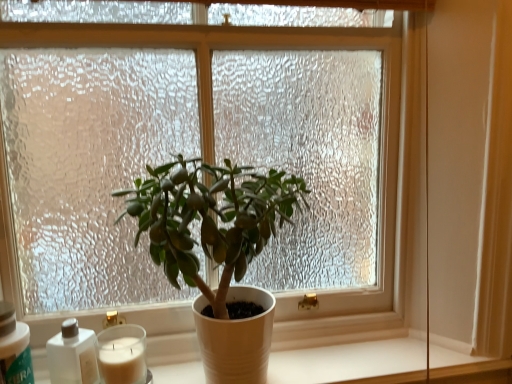
Question: From the image's perspective, is white plastic bottle at lower left, which appears as the 2th bottle when viewed from the right, located above or below white matte bottle at lower left, which appears as the 2th bottle when viewed from the left?

Choices:
 (A) below
 (B) above

Answer: (B)

Question: From a real-world perspective, is white plastic bottle at lower left, which appears as the 2th bottle when viewed from the right, above or below white matte bottle at lower left, positioned as the first bottle in right-to-left order?

Choices:
 (A) above
 (B) below

Answer: (A)

Question: Based on their relative distances, which object is nearer to the white matte bottle at lower left, which appears as the 2th bottle when viewed from the left?

Choices:
 (A) white matte pot at center
 (B) white plastic bottle at lower left, which appears as the 2th bottle when viewed from the right
 (C) white wax candle at lower left
 (D) matte white pot at center

Answer: (C)

Question: Based on their relative distances, which object is nearer to the white wax candle at lower left?

Choices:
 (A) white matte bottle at lower left, positioned as the first bottle in right-to-left order
 (B) matte white pot at center
 (C) white plastic bottle at lower left, which ranks as the first bottle in left-to-right order
 (D) white matte pot at center

Answer: (A)